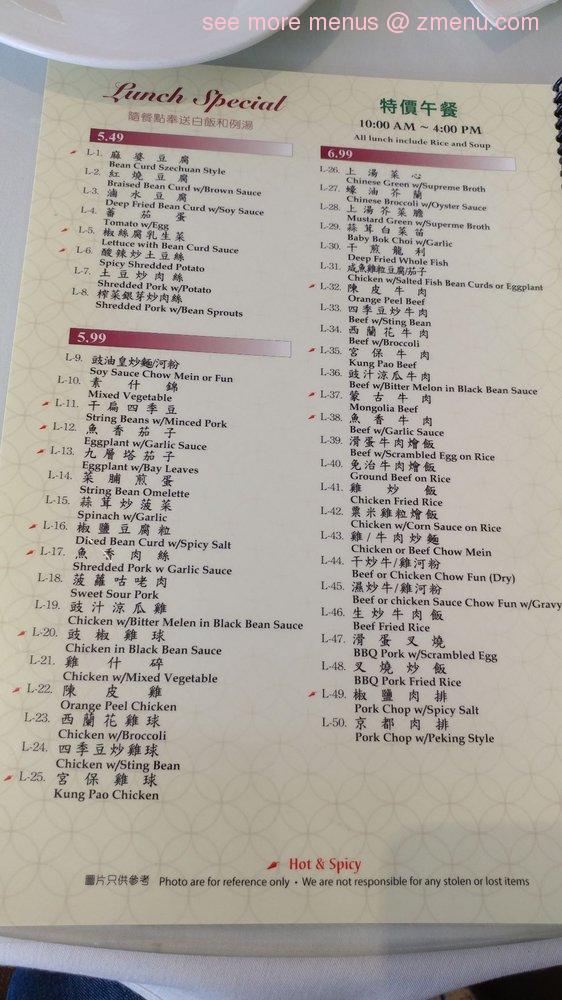
In order to click on table in this screenshot , I will do `click(335, 967)`.